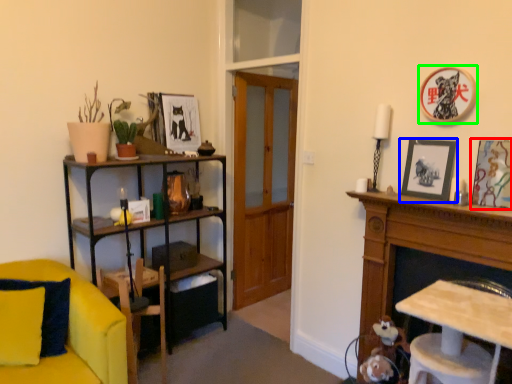
Question: Estimate the real-world distances between objects in this image. Which object is closer to picture frame (highlighted by a red box), picture frame (highlighted by a blue box) or picture frame (highlighted by a green box)?

Choices:
 (A) picture frame
 (B) picture frame

Answer: (A)